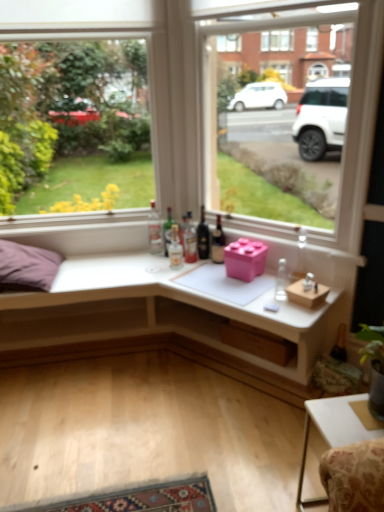
Identify the location of free spot to the left of clear glass bottle at center, the 7th bottle positioned from the right. (129, 256).